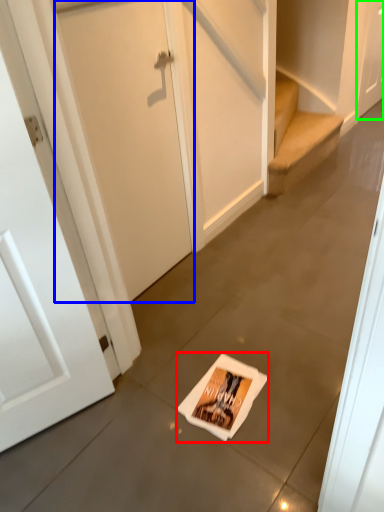
Question: Which object is positioned farthest from flyer (highlighted by a red box)? Select from door (highlighted by a blue box) and door (highlighted by a green box).

Choices:
 (A) door
 (B) door

Answer: (B)